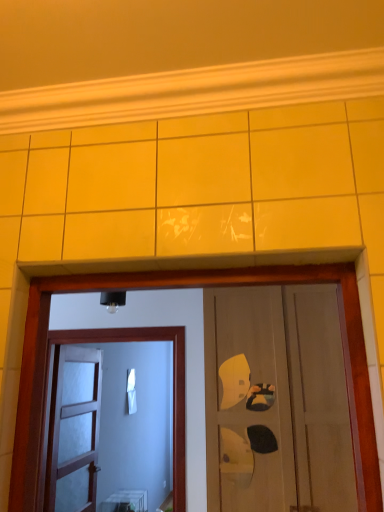
Question: Does matte wooden door at center, the third door viewed from the left, have a lesser height compared to translucent glass door at center, which appears as the third door when viewed from the right?

Choices:
 (A) no
 (B) yes

Answer: (A)

Question: Is matte wooden door at center, the third door viewed from the left, bigger than translucent glass door at center, which appears as the third door when viewed from the right?

Choices:
 (A) yes
 (B) no

Answer: (A)

Question: From a real-world perspective, is matte wooden door at center, which appears as the 1th door when viewed from the right, located higher than translucent glass door at center, the first door from the left?

Choices:
 (A) no
 (B) yes

Answer: (B)

Question: Considering the relative sizes of matte wooden door at center, the third door viewed from the left, and translucent glass door at center, the first door from the left, in the image provided, is matte wooden door at center, the third door viewed from the left, wider than translucent glass door at center, the first door from the left,?

Choices:
 (A) no
 (B) yes

Answer: (B)

Question: Is translucent glass door at center, the first door from the left, located within matte wooden door at center, the third door viewed from the left?

Choices:
 (A) no
 (B) yes

Answer: (A)

Question: From a real-world perspective, is matte wooden door at center, which appears as the 1th door when viewed from the right, under translucent glass door at center, which appears as the third door when viewed from the right?

Choices:
 (A) yes
 (B) no

Answer: (B)

Question: Could you tell me if matte wooden door at center, arranged as the 2th door when viewed from the right, is facing matte wooden door at center, the third door viewed from the left?

Choices:
 (A) yes
 (B) no

Answer: (B)

Question: From the image's perspective, would you say matte wooden door at center, arranged as the 2th door when viewed from the right, is positioned over matte wooden door at center, which appears as the 1th door when viewed from the right?

Choices:
 (A) no
 (B) yes

Answer: (A)

Question: Considering the relative sizes of matte wooden door at center, marked as the second door in a left-to-right arrangement, and matte wooden door at center, which appears as the 1th door when viewed from the right, in the image provided, is matte wooden door at center, marked as the second door in a left-to-right arrangement, smaller than matte wooden door at center, which appears as the 1th door when viewed from the right,?

Choices:
 (A) yes
 (B) no

Answer: (A)

Question: Considering the relative sizes of matte wooden door at center, arranged as the 2th door when viewed from the right, and matte wooden door at center, which appears as the 1th door when viewed from the right, in the image provided, is matte wooden door at center, arranged as the 2th door when viewed from the right, wider than matte wooden door at center, which appears as the 1th door when viewed from the right,?

Choices:
 (A) no
 (B) yes

Answer: (A)

Question: Is matte wooden door at center, marked as the second door in a left-to-right arrangement, facing away from matte wooden door at center, the third door viewed from the left?

Choices:
 (A) yes
 (B) no

Answer: (B)

Question: Is matte wooden door at center, the third door viewed from the left, a part of matte wooden door at center, arranged as the 2th door when viewed from the right?

Choices:
 (A) yes
 (B) no

Answer: (B)

Question: From a real-world perspective, is matte wooden door at center, which appears as the 1th door when viewed from the right, over matte wooden door at center, arranged as the 2th door when viewed from the right?

Choices:
 (A) no
 (B) yes

Answer: (B)